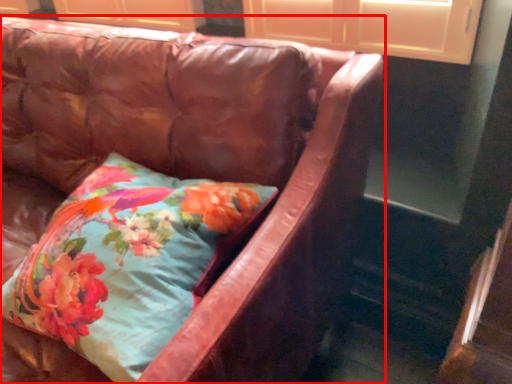
Question: From the image's perspective, where is studio couch (annotated by the red box) located in relation to pillow in the image?

Choices:
 (A) below
 (B) above

Answer: (B)